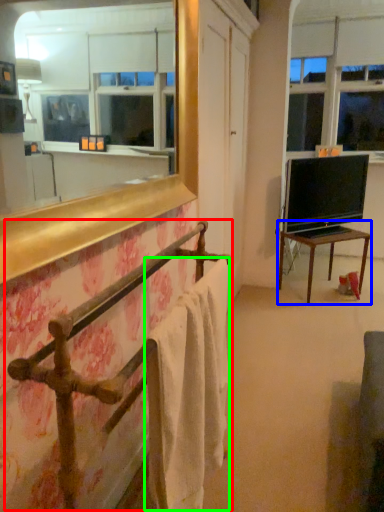
Question: Considering the real-world distances, which object is closest to balustrade (highlighted by a red box)? table (highlighted by a blue box) or bath towel (highlighted by a green box).

Choices:
 (A) table
 (B) bath towel

Answer: (B)